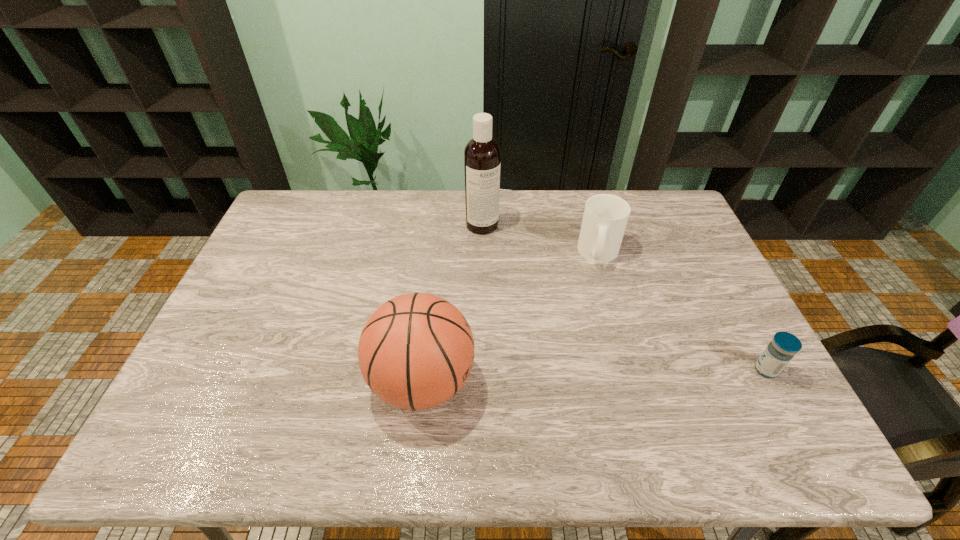
You are a GUI agent. You are given a task and a screenshot of the screen. Output one action in this format:
    pyautogui.click(x=<x>, y=<y>)
    Task: Click on the free space on the desktop that is between the basketball and the rightmost object and is positioned on the handle side of the third object from left to right
    
    Given the screenshot: What is the action you would take?
    pyautogui.click(x=612, y=375)

This screenshot has height=540, width=960. What are the coordinates of `vacant space on the desktop that is between the second tallest object and the rightmost object and is positioned on the label side of the farthest object` in the screenshot? It's located at (602, 375).